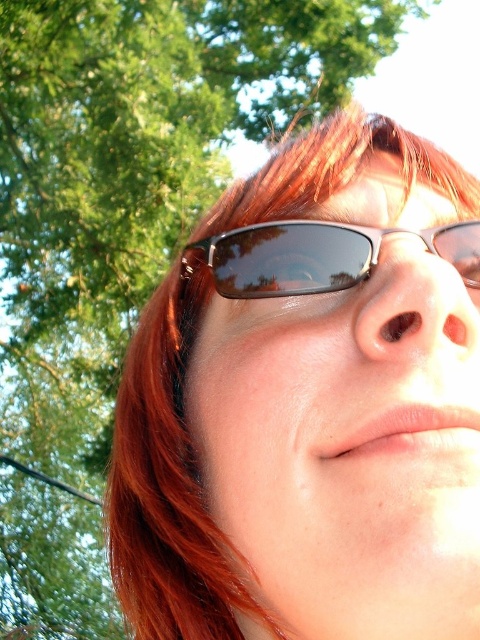
Question: Among these points, which one is nearest to the camera?

Choices:
 (A) (418, 164)
 (B) (348, 252)

Answer: (B)

Question: Is matte brown sunglasses at upper center closer to camera compared to sunglasses at center?

Choices:
 (A) no
 (B) yes

Answer: (A)

Question: Is matte brown sunglasses at upper center smaller than sunglasses at center?

Choices:
 (A) no
 (B) yes

Answer: (A)

Question: Which point is farther to the camera?

Choices:
 (A) (187, 444)
 (B) (309, 227)

Answer: (A)

Question: Which of the following is the closest to the observer?

Choices:
 (A) sunglasses at center
 (B) matte brown sunglasses at upper center

Answer: (A)

Question: Does matte brown sunglasses at upper center appear over sunglasses at center?

Choices:
 (A) no
 (B) yes

Answer: (A)